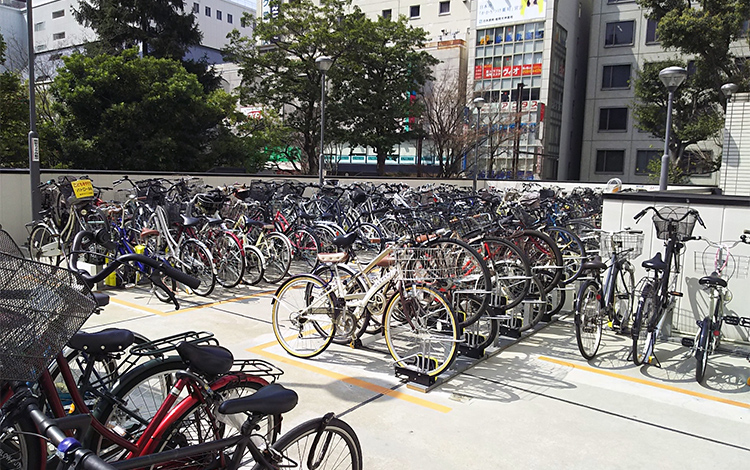
The width and height of the screenshot is (750, 470). In order to click on wall in this screenshot , I will do `click(9, 186)`, `click(620, 211)`, `click(512, 182)`.